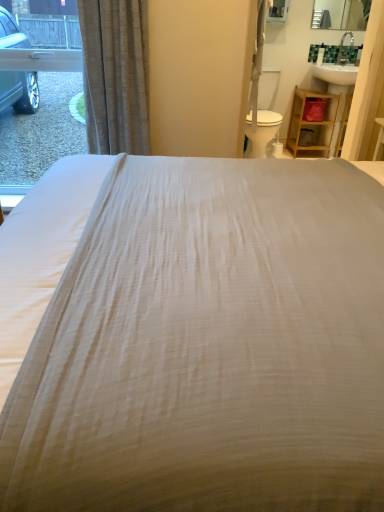
Question: Should I look upward or downward to see white plastic swivel chair at center-right?

Choices:
 (A) up
 (B) down

Answer: (A)

Question: Is white plastic swivel chair at center-right looking in the opposite direction of white textured bed at center?

Choices:
 (A) no
 (B) yes

Answer: (A)

Question: Are white plastic swivel chair at center-right and white textured bed at center located far from each other?

Choices:
 (A) yes
 (B) no

Answer: (A)

Question: Is white plastic swivel chair at center-right outside of white textured bed at center?

Choices:
 (A) no
 (B) yes

Answer: (B)

Question: Is white textured bed at center a part of white plastic swivel chair at center-right?

Choices:
 (A) yes
 (B) no

Answer: (B)

Question: Is white plastic swivel chair at center-right to the left of white textured bed at center from the viewer's perspective?

Choices:
 (A) yes
 (B) no

Answer: (B)

Question: Does white plastic swivel chair at center-right lie in front of white textured bed at center?

Choices:
 (A) yes
 (B) no

Answer: (B)

Question: Does clear glass window at left have a greater width compared to wooden shelf at right?

Choices:
 (A) yes
 (B) no

Answer: (B)

Question: Would you say wooden shelf at right is part of clear glass window at left's contents?

Choices:
 (A) no
 (B) yes

Answer: (A)

Question: From the image's perspective, is clear glass window at left below wooden shelf at right?

Choices:
 (A) yes
 (B) no

Answer: (A)

Question: Is clear glass window at left not near wooden shelf at right?

Choices:
 (A) yes
 (B) no

Answer: (A)

Question: Does clear glass window at left have a smaller size compared to wooden shelf at right?

Choices:
 (A) no
 (B) yes

Answer: (A)

Question: From a real-world perspective, is clear glass window at left beneath wooden shelf at right?

Choices:
 (A) yes
 (B) no

Answer: (B)

Question: Is wooden shelf at right positioned in front of white plastic swivel chair at center-right?

Choices:
 (A) no
 (B) yes

Answer: (A)